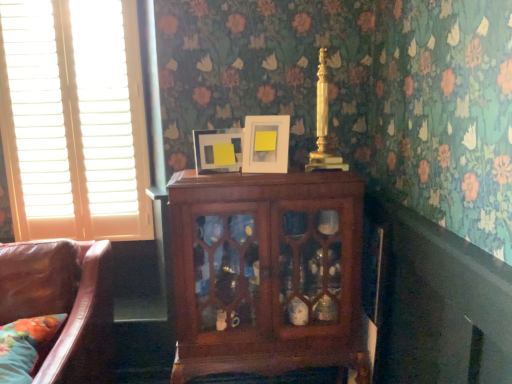
Where is `free space above floral fabric pillow at lower left (from a real-world perspective)`? The image size is (512, 384). free space above floral fabric pillow at lower left (from a real-world perspective) is located at coordinates (23, 336).